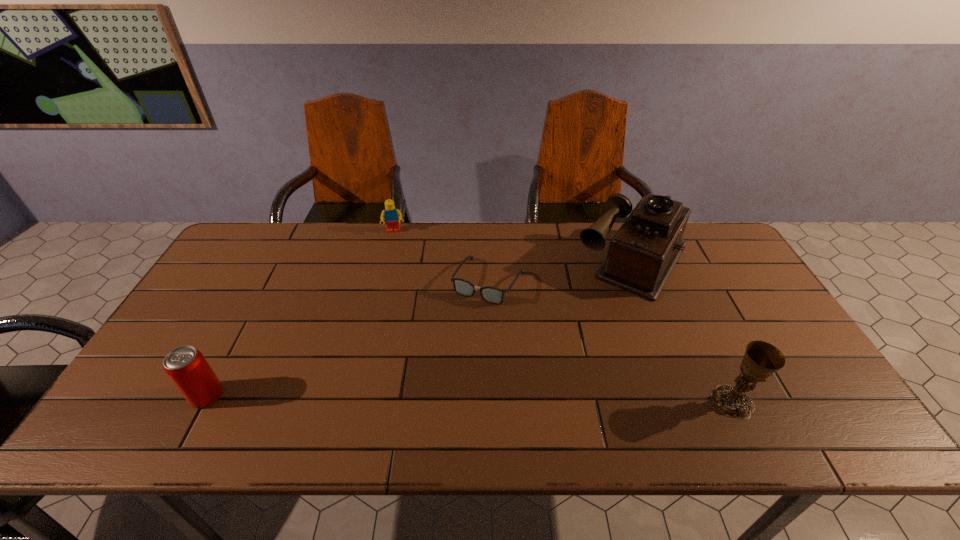
The image size is (960, 540). In order to click on free point between the spectacles and the fourth tallest object in this screenshot , I will do `click(442, 256)`.

Find the location of `empty space between the Lego and the chalice`. empty space between the Lego and the chalice is located at coordinates (564, 316).

The width and height of the screenshot is (960, 540). I want to click on free space between the shortest object and the phonograph_record, so click(x=562, y=270).

Select which object is the closest to the chalice. Please provide its 2D coordinates. Your answer should be formatted as a tuple, i.e. [(x, y)], where the tuple contains the x and y coordinates of a point satisfying the conditions above.

[(642, 254)]

At what (x,y) coordinates should I click in order to perform the action: click on object that stands as the second closest to the fourth object from right to left. Please return your answer as a coordinate pair (x, y). Looking at the image, I should click on (642, 254).

Locate an element on the screen. This screenshot has height=540, width=960. free spot that satisfies the following two spatial constraints: 1. on the front side of the chalice; 2. on the right side of the second shortest object is located at coordinates (352, 402).

In order to click on free location that satisfies the following two spatial constraints: 1. on the back side of the phonograph_record; 2. on the right side of the leftmost object in this screenshot , I will do `click(278, 259)`.

Identify the location of free space in the image that satisfies the following two spatial constraints: 1. on the front side of the third shortest object; 2. on the left side of the chalice. Image resolution: width=960 pixels, height=540 pixels. (204, 402).

The width and height of the screenshot is (960, 540). Identify the location of vacant space that satisfies the following two spatial constraints: 1. on the front side of the chalice; 2. on the left side of the phonograph_record. (691, 402).